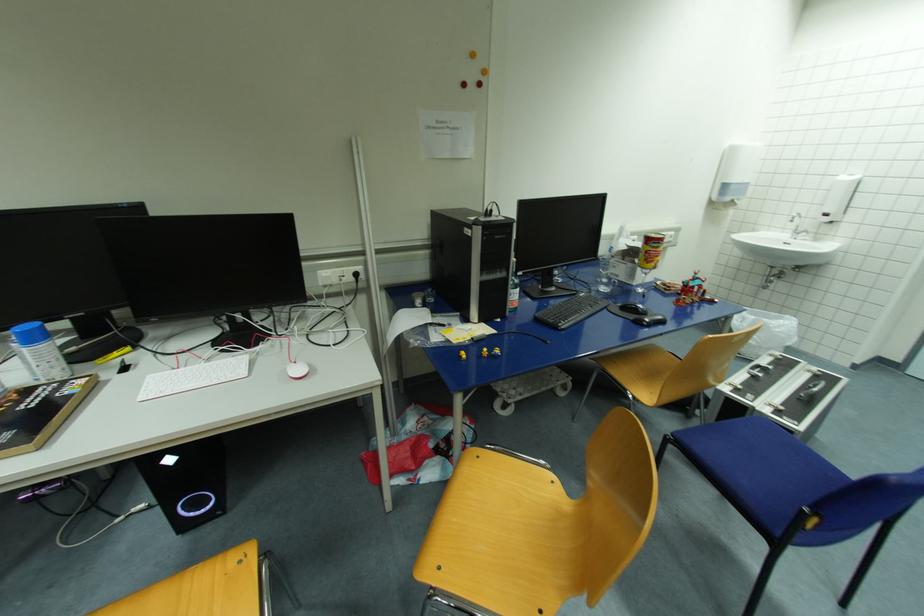
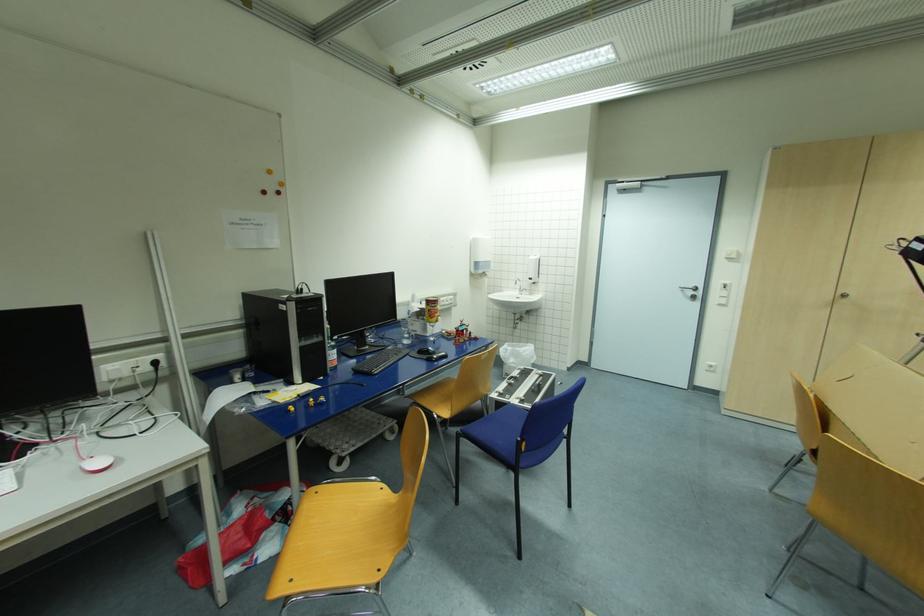
Locate, in the second image, the point that corresponds to (x=629, y=387) in the first image.

(434, 410)